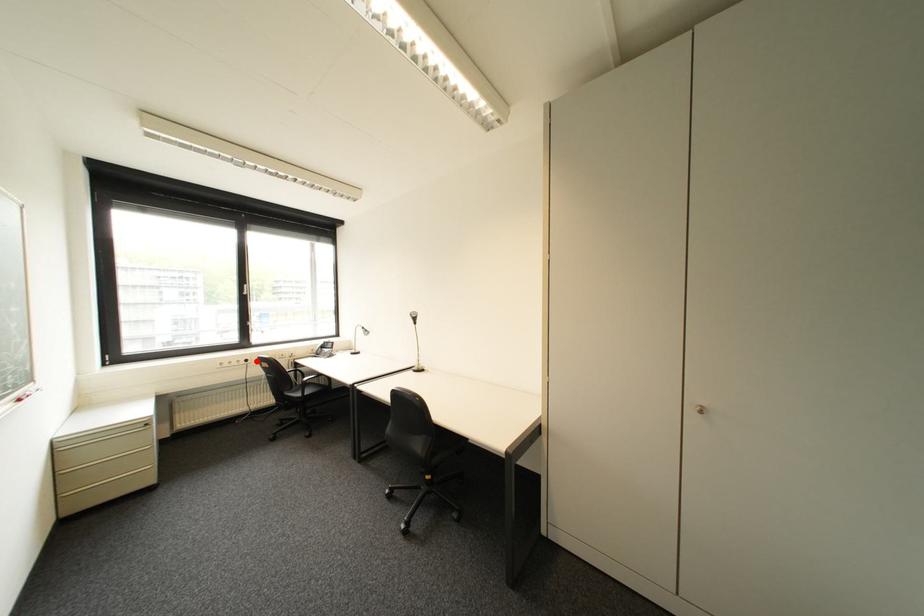
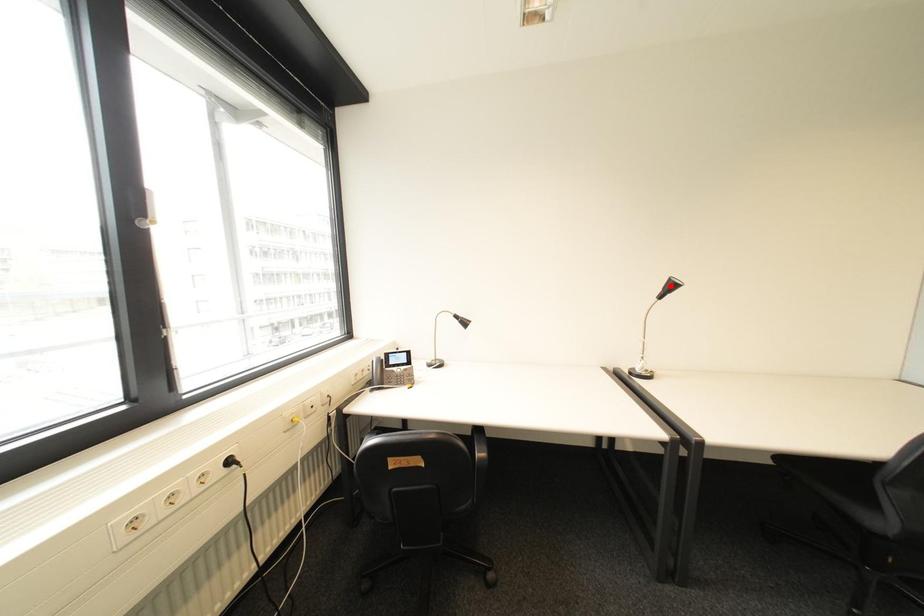
I am providing you with two images of the same scene from different viewpoints. A red point is marked on the first image and another point is marked on the second image. Are the points marked in image1 and image2 representing the same 3D position?

No